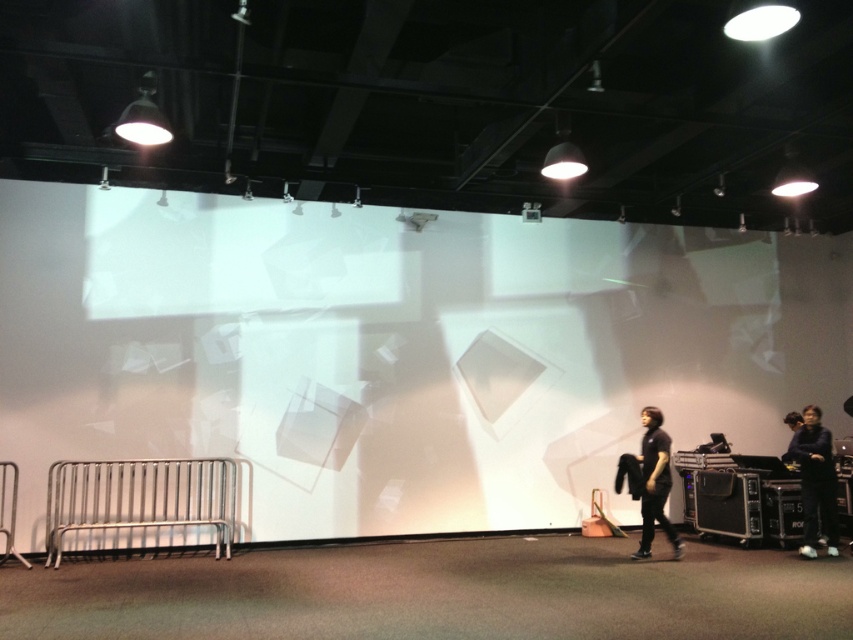
Question: Is dark blue fabric jacket at lower right bigger than dark gray shirt at lower right?

Choices:
 (A) yes
 (B) no

Answer: (A)

Question: Which point appears closest to the camera in this image?

Choices:
 (A) (805, 420)
 (B) (660, 484)

Answer: (B)

Question: Among these objects, which one is farthest from the camera?

Choices:
 (A) dark gray shirt at lower right
 (B) dark blue fabric jacket at lower right

Answer: (B)

Question: Can you confirm if dark blue fabric jacket at lower right is positioned to the right of dark gray shirt at lower right?

Choices:
 (A) yes
 (B) no

Answer: (A)

Question: Is dark blue fabric jacket at lower right to the right of dark gray shirt at lower right from the viewer's perspective?

Choices:
 (A) yes
 (B) no

Answer: (A)

Question: Which object appears farthest from the camera in this image?

Choices:
 (A) dark blue fabric jacket at lower right
 (B) dark gray shirt at lower right

Answer: (A)